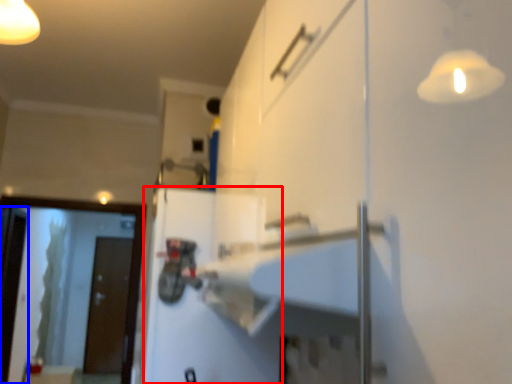
Question: Among these objects, which one is nearest to the camera, door (highlighted by a red box) or screen door (highlighted by a blue box)?

Choices:
 (A) door
 (B) screen door

Answer: (A)